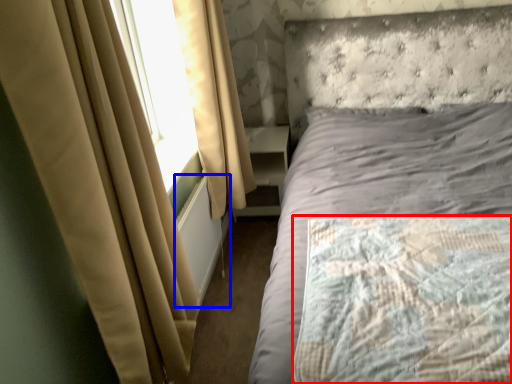
Question: Which object is closer to the camera taking this photo, mattress (highlighted by a red box) or radiator (highlighted by a blue box)?

Choices:
 (A) mattress
 (B) radiator

Answer: (A)